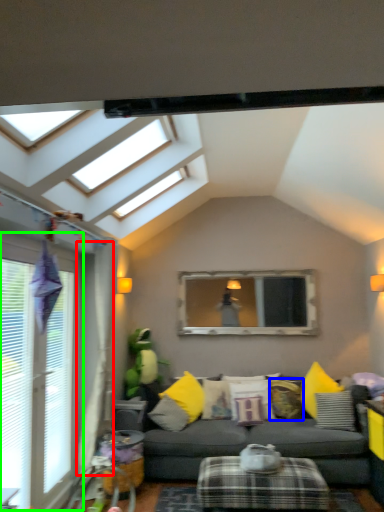
Question: Which object is positioned closest to curtain (highlighted by a red box)? Select from pillow (highlighted by a blue box) and window (highlighted by a green box).

Choices:
 (A) pillow
 (B) window

Answer: (B)